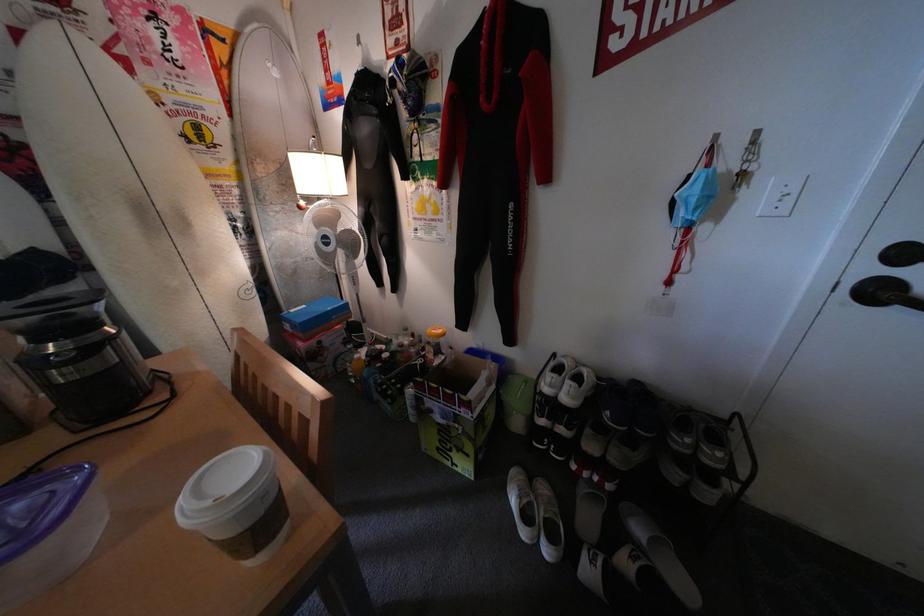
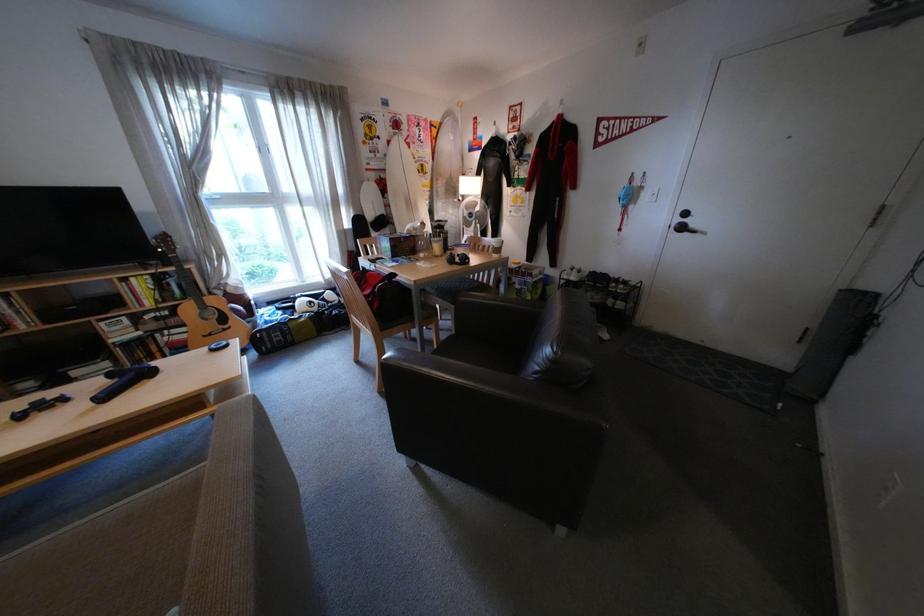
Find the pixel in the second image that matches point 205,73 in the first image.

(439, 145)